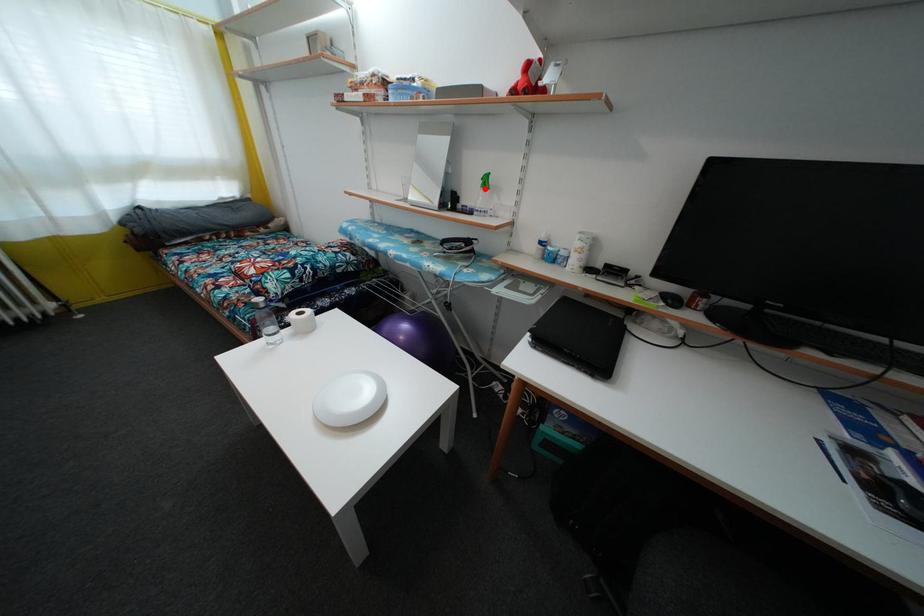
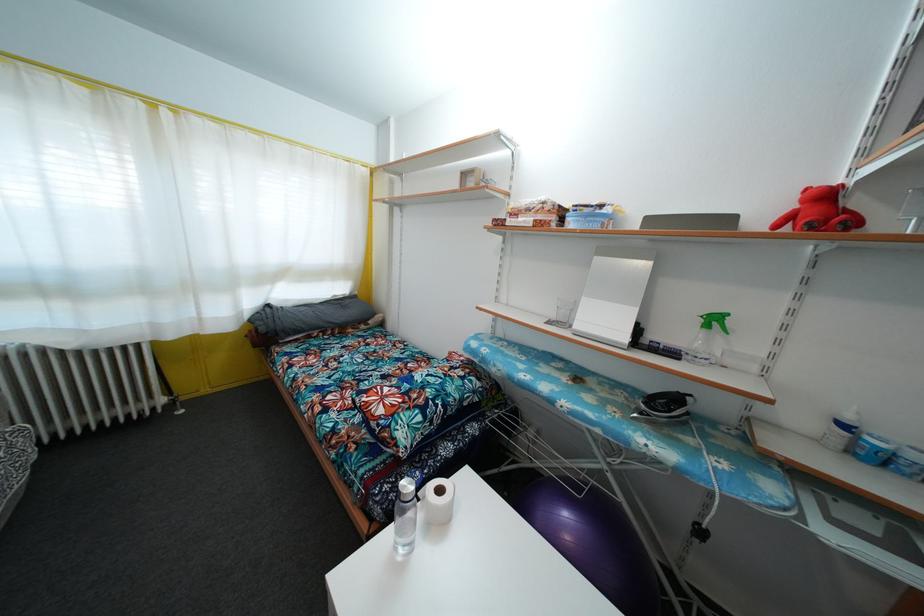
In the second image, find the point that corresponds to the highlighted location in the first image.

(706, 328)